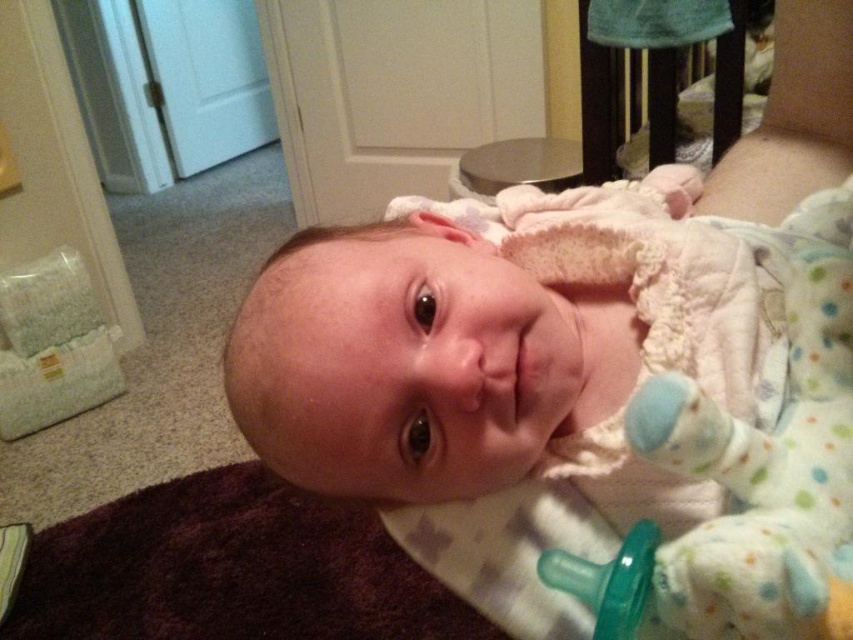
Who is positioned more to the left, white soft fabric baby at center or wooden crib at upper right?

From the viewer's perspective, white soft fabric baby at center appears more on the left side.

Does white soft fabric baby at center have a greater width compared to wooden crib at upper right?

Yes, white soft fabric baby at center is wider than wooden crib at upper right.

This screenshot has width=853, height=640. Describe the element at coordinates (573, 394) in the screenshot. I see `white soft fabric baby at center` at that location.

In order to click on white soft fabric baby at center in this screenshot , I will do tap(573, 394).

Can you confirm if wooden crib at upper right is bigger than green rubber pacifier at lower center?

Correct, wooden crib at upper right is larger in size than green rubber pacifier at lower center.

Does wooden crib at upper right appear on the left side of green rubber pacifier at lower center?

No, wooden crib at upper right is not to the left of green rubber pacifier at lower center.

The image size is (853, 640). What do you see at coordinates (659, 77) in the screenshot?
I see `wooden crib at upper right` at bounding box center [659, 77].

The image size is (853, 640). Identify the location of wooden crib at upper right. (659, 77).

Does white soft fabric baby at center have a greater width compared to green rubber pacifier at lower center?

Yes.

Consider the image. Is white soft fabric baby at center taller than green rubber pacifier at lower center?

Indeed, white soft fabric baby at center has a greater height compared to green rubber pacifier at lower center.

Which is behind, point (630, 332) or point (621, 637)?

The point (630, 332) is behind.

Where is `white soft fabric baby at center`? white soft fabric baby at center is located at coordinates (573, 394).